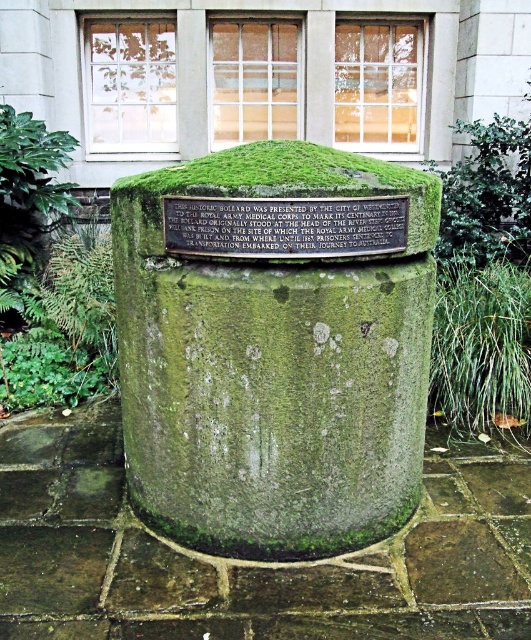
Question: Does green mossy stone pillar at center have a smaller size compared to green mossy stone plaque at center?

Choices:
 (A) yes
 (B) no

Answer: (B)

Question: Which point is farther to the camera?

Choices:
 (A) (312, 198)
 (B) (345, 472)

Answer: (B)

Question: Which of the following is the closest to the observer?

Choices:
 (A) (378, 205)
 (B) (261, 339)

Answer: (A)

Question: Observing the image, what is the correct spatial positioning of green mossy stone pillar at center in reference to green mossy stone plaque at center?

Choices:
 (A) right
 (B) left

Answer: (B)

Question: Can you confirm if green mossy stone pillar at center is positioned above green mossy stone plaque at center?

Choices:
 (A) yes
 (B) no

Answer: (B)